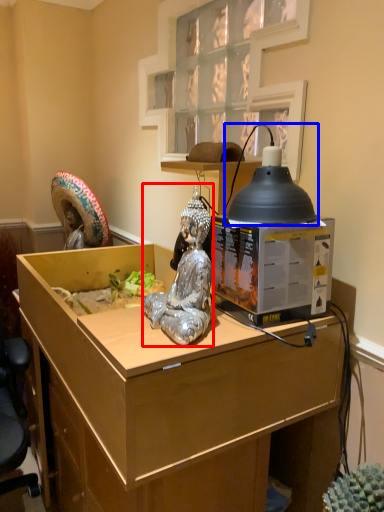
Question: Which object appears closest to the camera in this image, person (highlighted by a red box) or lamp (highlighted by a blue box)?

Choices:
 (A) person
 (B) lamp

Answer: (A)